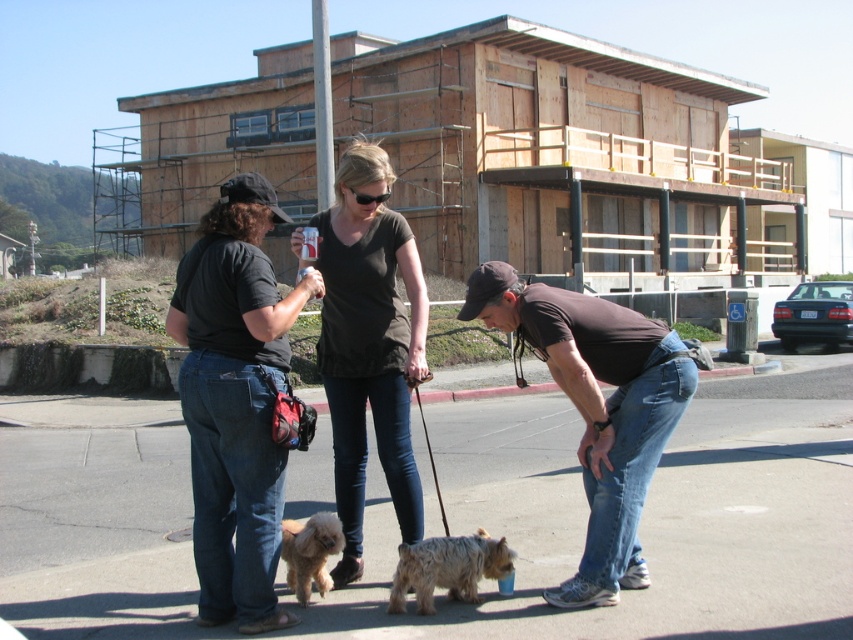
You are a photographer trying to capture a photo of the fluffy golden dog at center. There is a brown cotton shirt at lower center blocking the view. Can you move the shirt to the left to get a clear shot?

The brown cotton shirt at lower center is positioned on the right side of the fluffy golden dog at center, so moving the shirt to the left would allow you to get a clear shot of the fluffy golden dog at center.